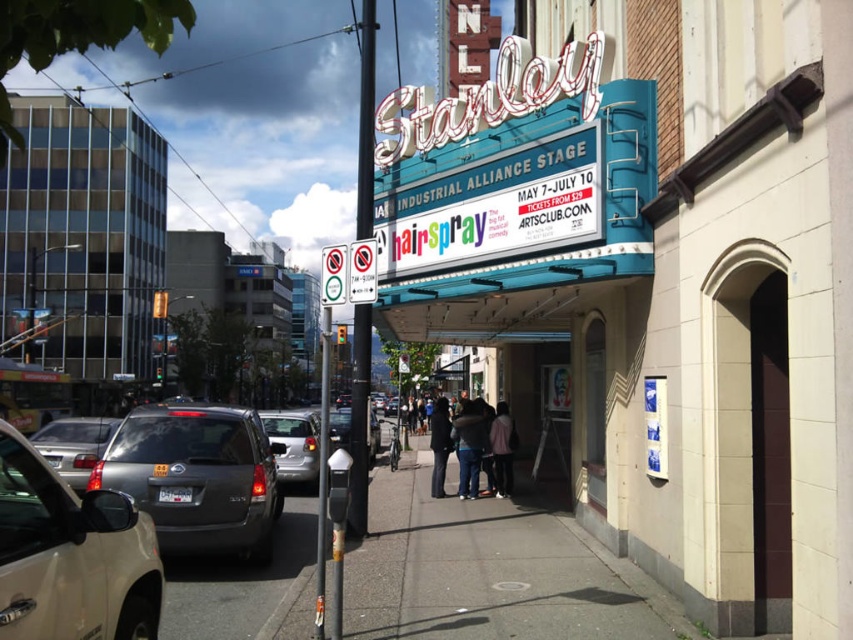
Question: Which of the following is the farthest from the observer?

Choices:
 (A) matte gray suv at center-left
 (B) denim pants at center

Answer: (B)

Question: Is smooth concrete sidewalk at center thinner than matte gray suv at center-left?

Choices:
 (A) yes
 (B) no

Answer: (B)

Question: Does matte gray suv at left have a smaller size compared to denim pants at center?

Choices:
 (A) yes
 (B) no

Answer: (B)

Question: Which of the following is the closest to the observer?

Choices:
 (A) matte gray suv at left
 (B) dark gray fabric jacket at center
 (C) satin silver sedan at lower left

Answer: (C)

Question: Does smooth concrete sidewalk at center have a greater width compared to matte gray sedan at left?

Choices:
 (A) no
 (B) yes

Answer: (A)

Question: Which of the following is the farthest from the observer?

Choices:
 (A) matte gray sedan at left
 (B) matte gray suv at center-left
 (C) matte gray suv at left

Answer: (A)